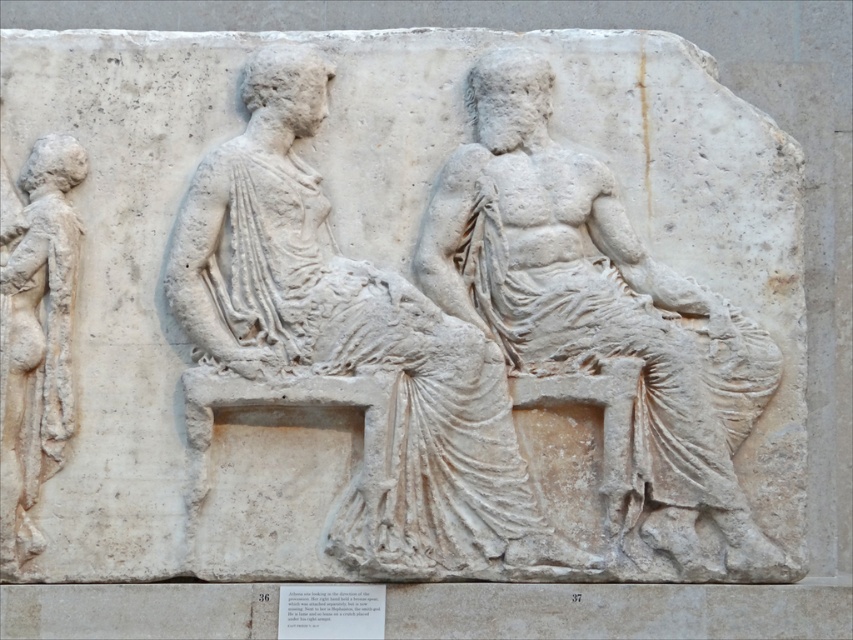
Based on the coordinates provided in the description, where is the white marble reclining figure at center located in the image?

The white marble reclining figure at center is located at point coordinates of (x=344, y=346).

Based on the scene described, which of the two figures, the white marble reclining figure at center or the white marble figure at left, has a larger width?

The white marble reclining figure at center might be wider than white marble figure at left according to the description.